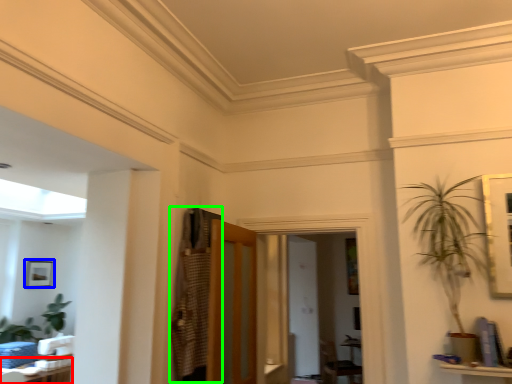
Question: Considering the real-world distances, which object is farthest from table (highlighted by a red box)? picture frame (highlighted by a blue box) or armoire (highlighted by a green box)?

Choices:
 (A) picture frame
 (B) armoire

Answer: (A)